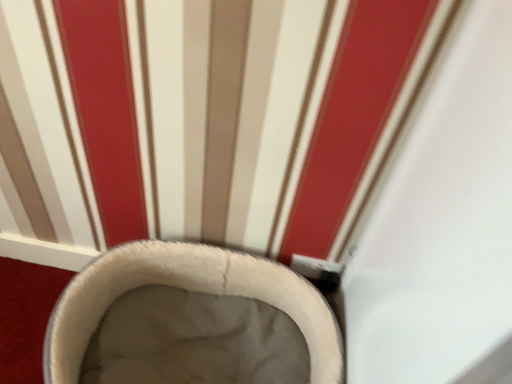
You are a GUI agent. You are given a task and a screenshot of the screen. Output one action in this format:
    pyautogui.click(x=<x>, y=<y>)
    Task: Click on the beige fabric toilet at lower center
    The height and width of the screenshot is (384, 512).
    Given the screenshot: What is the action you would take?
    pyautogui.click(x=190, y=320)

Describe the element at coordinates (190, 320) in the screenshot. I see `beige fabric toilet at lower center` at that location.

At what (x,y) coordinates should I click in order to perform the action: click on beige fabric toilet at lower center. Please return your answer as a coordinate pair (x, y). The image size is (512, 384). Looking at the image, I should click on (190, 320).